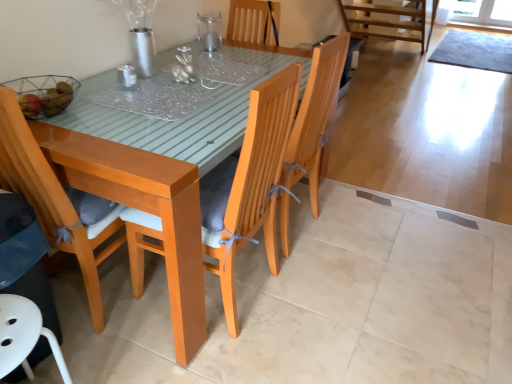
Where is `free spot to the right of clear glass vase at upper center, acting as the second tableware starting from the front`? free spot to the right of clear glass vase at upper center, acting as the second tableware starting from the front is located at coordinates (242, 52).